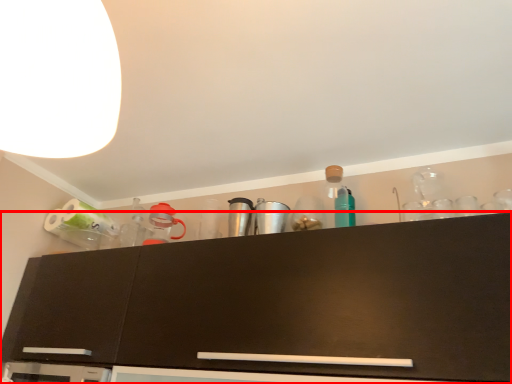
Question: In this image, where is cabinetry (annotated by the red box) located relative to lamp?

Choices:
 (A) right
 (B) left

Answer: (A)